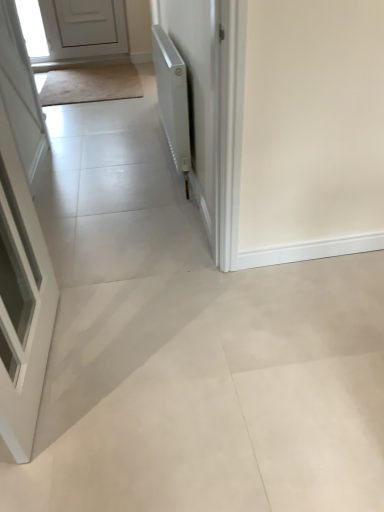
At what (x,y) coordinates should I click in order to perform the action: click on free space in front of white glossy door at left, placed as the first door when sorted from bottom to top. Please return your answer as a coordinate pair (x, y). Looking at the image, I should click on (87, 452).